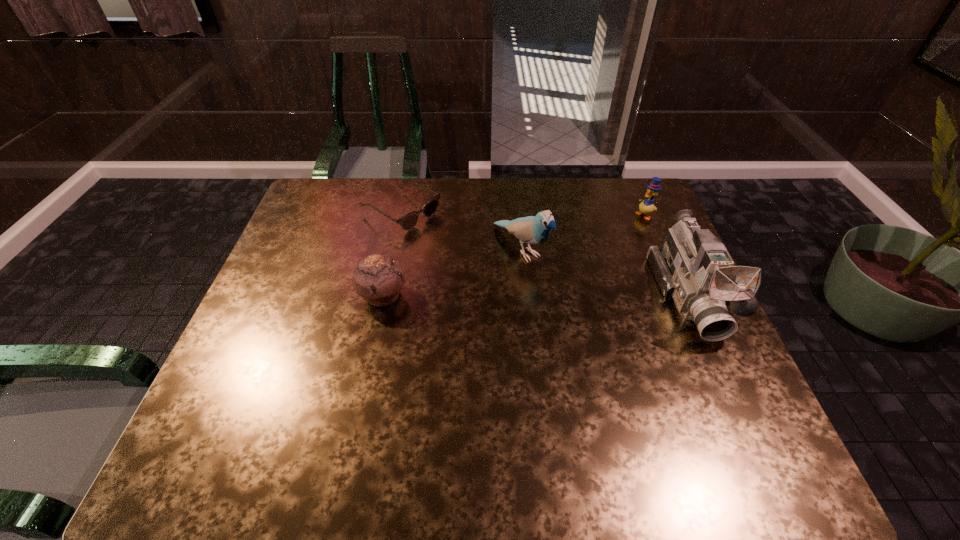
At what (x,y) coordinates should I click in order to perform the action: click on free space on the desktop that is between the muffin and the camcorder and is positioned at the face of the third object from left to right. Please return your answer as a coordinate pair (x, y). The width and height of the screenshot is (960, 540). Looking at the image, I should click on (574, 296).

Identify the location of free space on the desktop that is between the muffin and the camcorder and is positioned on the front lenses of the sunglasses. (545, 296).

Where is `free space on the desktop that is between the muffin and the camcorder and is positioned on the face of the duckling, where the monocle is placed`? free space on the desktop that is between the muffin and the camcorder and is positioned on the face of the duckling, where the monocle is placed is located at coordinates (510, 296).